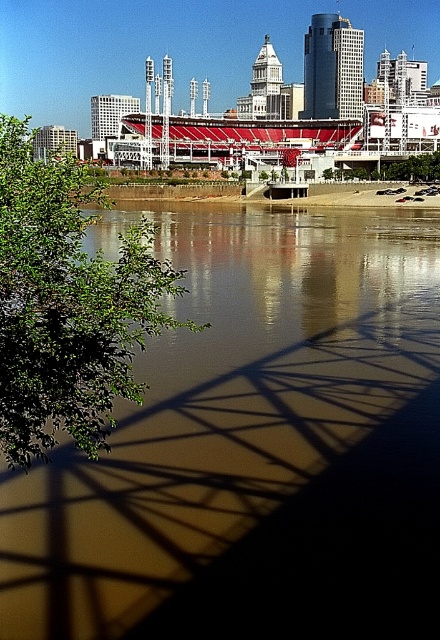
Is brown reflective water at center to the left of green leafy tree at left from the viewer's perspective?

In fact, brown reflective water at center is to the right of green leafy tree at left.

Consider the image. Between brown reflective water at center and green leafy tree at left, which one is positioned higher?

green leafy tree at left is above.

Is point (303, 253) in front of point (14, 156)?

No, (303, 253) is further to viewer.

The width and height of the screenshot is (440, 640). What are the coordinates of `brown reflective water at center` in the screenshot? It's located at (253, 445).